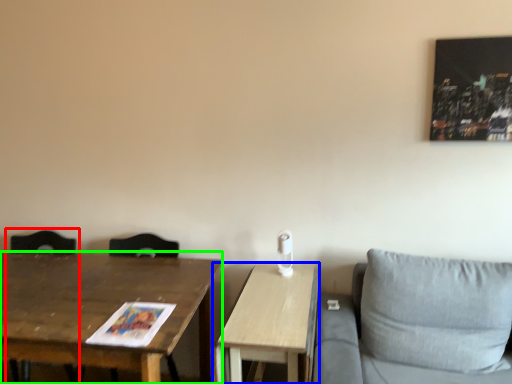
Question: Which object is the closest to the swivel chair (highlighted by a red box)? Choose among these: table (highlighted by a blue box) or table (highlighted by a green box).

Choices:
 (A) table
 (B) table

Answer: (B)